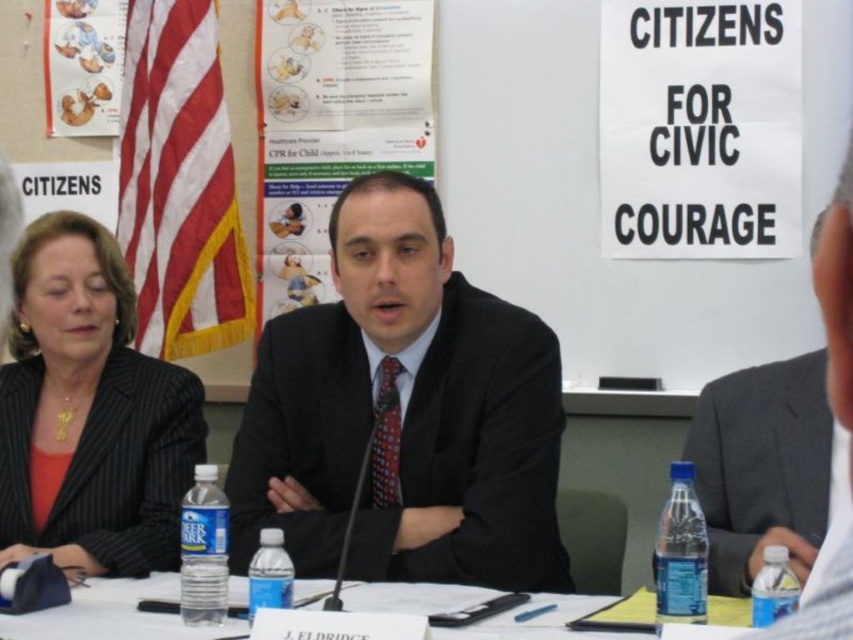
Who is more distant from viewer, (151, 356) or (308, 216)?

Positioned behind is point (308, 216).

Is point (39, 330) behind point (289, 193)?

No.

Locate an element on the screen. black pinstripe suit at left is located at coordinates (90, 412).

Who is lower down, black suit at center or paper with printed text at center?

black suit at center is below.

Is point (419, 305) closer to viewer compared to point (346, 48)?

Yes, it is.

Does point (509, 564) lie in front of point (404, 129)?

Yes, it is in front of point (404, 129).

Identify the location of black suit at center. (403, 413).

Is black suit at center positioned before black matte suit at right?

No, it is behind black matte suit at right.

Who is higher up, black suit at center or black matte suit at right?

black suit at center is above.

Where is `black suit at center`? The width and height of the screenshot is (853, 640). black suit at center is located at coordinates (403, 413).